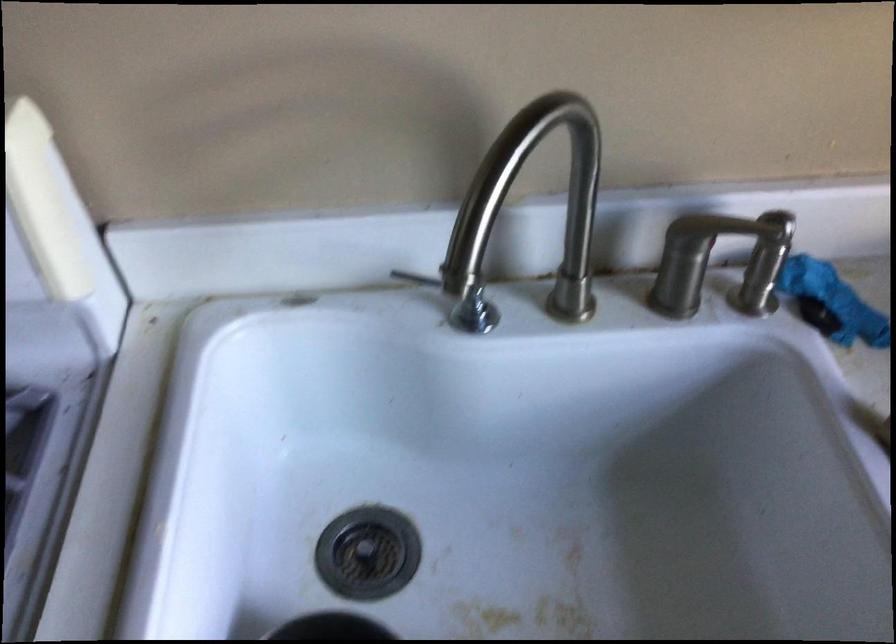
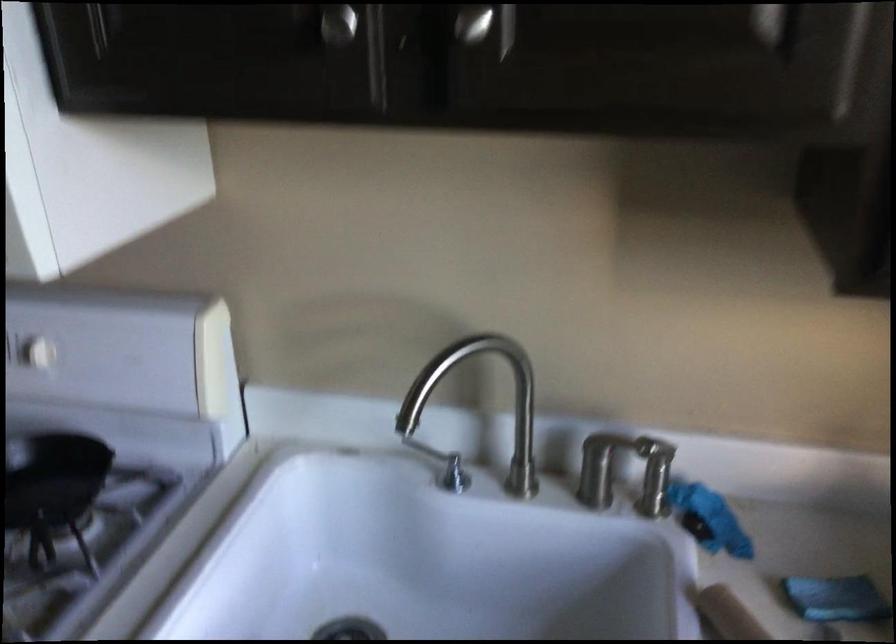
The point at (693, 261) is marked in the first image. Where is the corresponding point in the second image?

(606, 465)